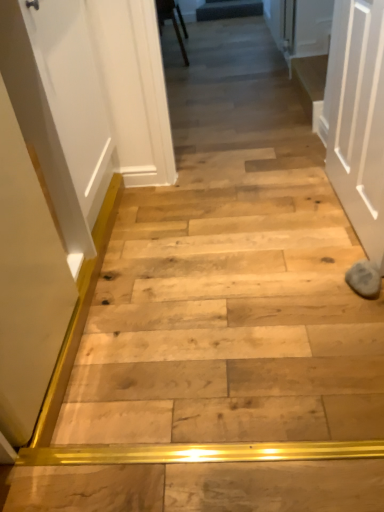
Question: Is white matte door at right positioned behind wooden chair at upper center?

Choices:
 (A) yes
 (B) no

Answer: (B)

Question: From a real-world perspective, is white matte door at right positioned over wooden chair at upper center based on gravity?

Choices:
 (A) yes
 (B) no

Answer: (A)

Question: Is white matte door at right wider than wooden chair at upper center?

Choices:
 (A) yes
 (B) no

Answer: (B)

Question: Is white matte door at right aimed at wooden chair at upper center?

Choices:
 (A) no
 (B) yes

Answer: (A)

Question: Considering the relative sizes of white matte door at right and wooden chair at upper center in the image provided, is white matte door at right taller than wooden chair at upper center?

Choices:
 (A) no
 (B) yes

Answer: (B)

Question: Which is correct: dark gray fabric at upper center, which appears as the 1th stairwell when viewed from the top, is inside wooden chair at upper center, or outside of it?

Choices:
 (A) inside
 (B) outside

Answer: (B)

Question: Is point (243, 6) closer or farther from the camera than point (173, 24)?

Choices:
 (A) farther
 (B) closer

Answer: (A)

Question: From the image's perspective, is dark gray fabric at upper center, the second stairwell positioned from the right, positioned above or below wooden chair at upper center?

Choices:
 (A) above
 (B) below

Answer: (A)

Question: Looking at the image, does dark gray fabric at upper center, which appears as the 1th stairwell when viewed from the left, seem bigger or smaller compared to wooden chair at upper center?

Choices:
 (A) big
 (B) small

Answer: (B)

Question: Looking at their shapes, would you say wooden chair at upper center is wider or thinner than dark gray fabric at upper center, which appears as the 1th stairwell when viewed from the left?

Choices:
 (A) wide
 (B) thin

Answer: (A)

Question: Based on their positions, is wooden chair at upper center located to the left or right of dark gray fabric at upper center, the 2th stairwell positioned from the bottom?

Choices:
 (A) right
 (B) left

Answer: (B)

Question: Is point (183, 54) positioned closer to the camera than point (256, 6)?

Choices:
 (A) farther
 (B) closer

Answer: (B)

Question: Considering the positions of wooden chair at upper center and dark gray fabric at upper center, the 2th stairwell positioned from the bottom, in the image, is wooden chair at upper center taller or shorter than dark gray fabric at upper center, the 2th stairwell positioned from the bottom,?

Choices:
 (A) tall
 (B) short

Answer: (A)

Question: Relative to wooden step at center, which is the 2th stairwell in back-to-front order, is dark gray fabric at upper center, which appears as the 1th stairwell when viewed from the left, in front or behind?

Choices:
 (A) behind
 (B) front

Answer: (A)

Question: From their relative heights in the image, would you say dark gray fabric at upper center, which appears as the 1th stairwell when viewed from the left, is taller or shorter than wooden step at center, the 1th stairwell from the right?

Choices:
 (A) short
 (B) tall

Answer: (A)